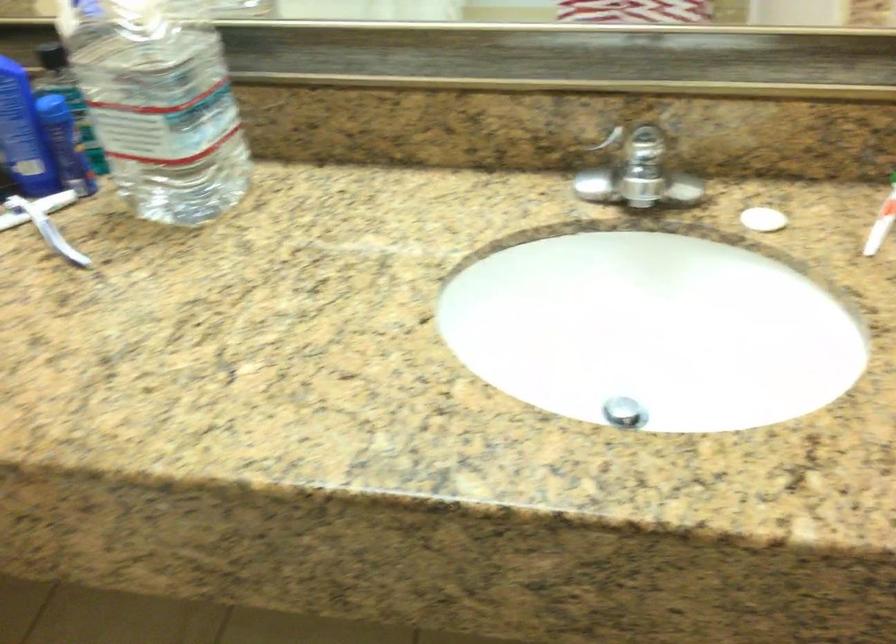
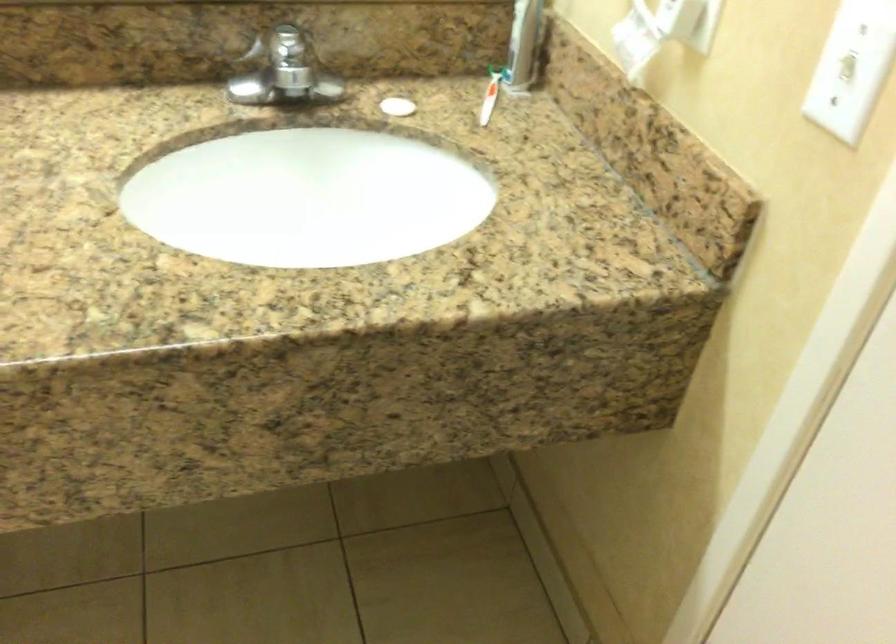
Where in the second image is the point corresponding to point 633,175 from the first image?

(285, 69)